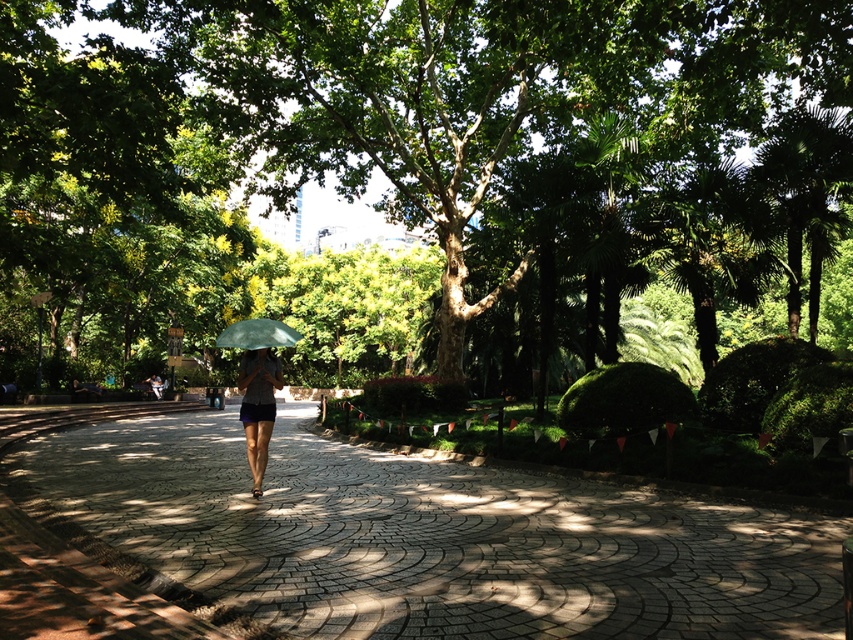
Question: Is dark gray fabric umbrella at center bigger than green matte umbrella at center?

Choices:
 (A) yes
 (B) no

Answer: (B)

Question: Among these points, which one is nearest to the camera?

Choices:
 (A) (244, 424)
 (B) (598, 296)
 (C) (254, 323)
 (D) (281, 570)

Answer: (D)

Question: Which point is farther from the camera taking this photo?

Choices:
 (A) (792, 545)
 (B) (247, 326)
 (C) (119, 86)

Answer: (C)

Question: Which point is farther from the camera taking this photo?

Choices:
 (A) (105, 534)
 (B) (624, 58)
 (C) (267, 412)

Answer: (B)

Question: Does gray cobblestone pavement at center appear on the left side of dark gray fabric umbrella at center?

Choices:
 (A) yes
 (B) no

Answer: (A)

Question: Does green leafy tree at center appear under dark gray fabric umbrella at center?

Choices:
 (A) yes
 (B) no

Answer: (B)